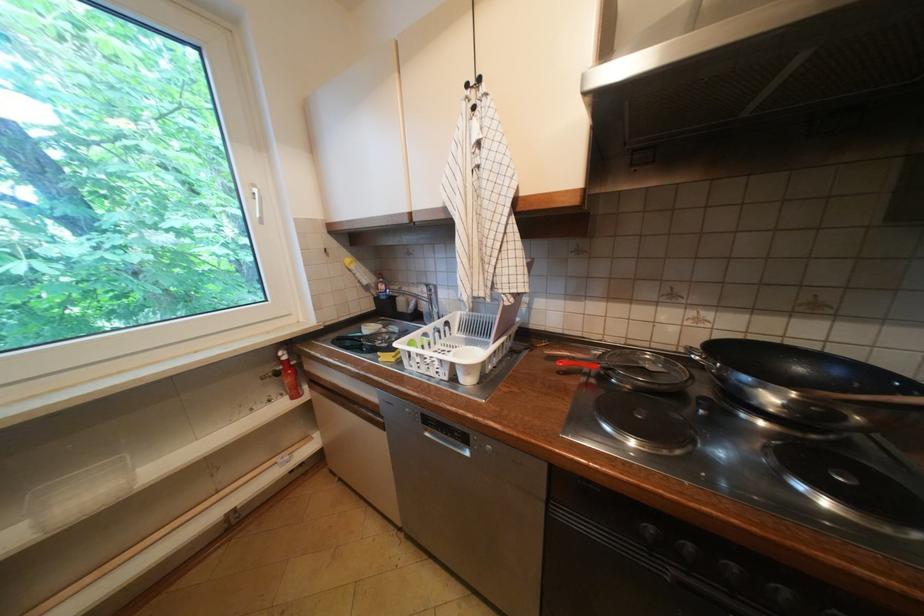
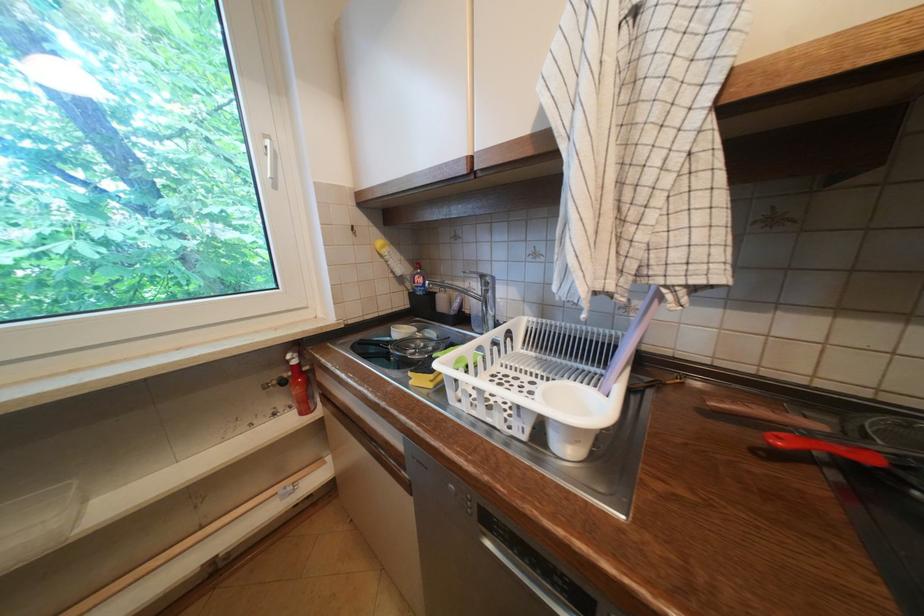
Question: The images are taken continuously from a first-person perspective. In which direction is your viewpoint rotating?

Choices:
 (A) Left
 (B) Right
 (C) Up
 (D) Down

Answer: (A)